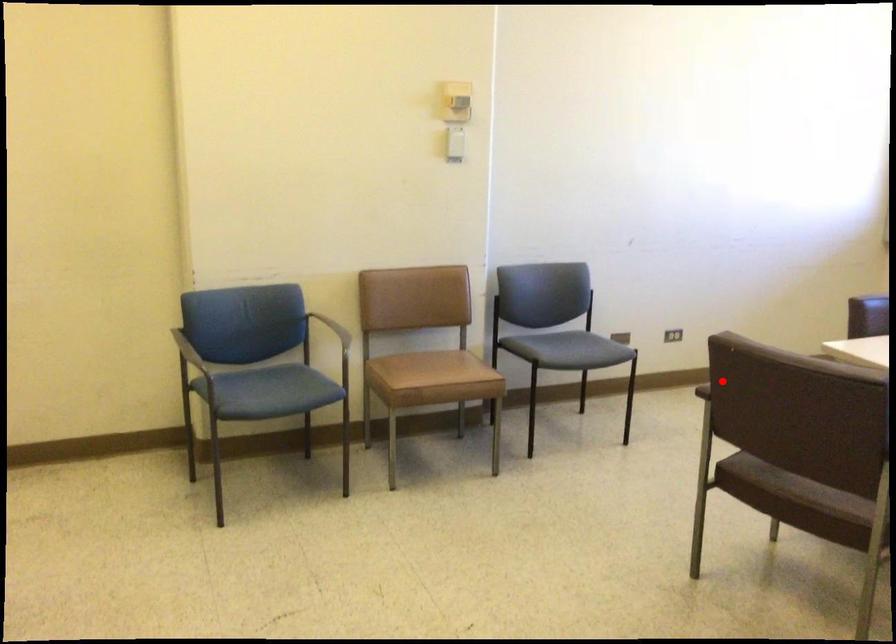
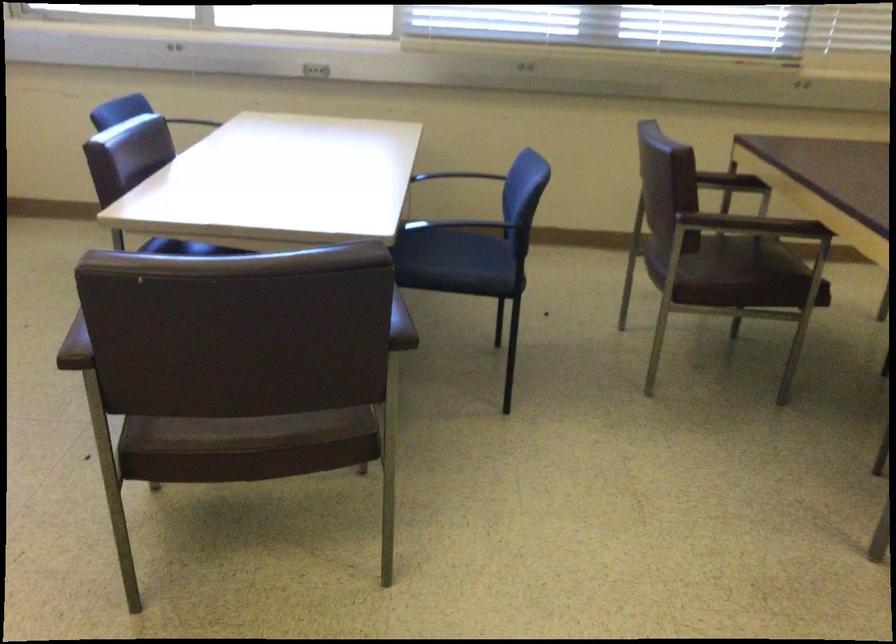
Find the pixel in the second image that matches the highlighted location in the first image.

(75, 346)